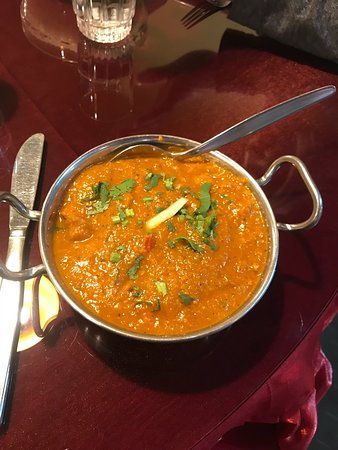
You are a GUI agent. You are given a task and a screenshot of the screen. Output one action in this format:
    pyautogui.click(x=<x>, y=<y>)
    Task: Click on the bowl
    The image size is (338, 450).
    Given the screenshot: What is the action you would take?
    pyautogui.click(x=257, y=296)